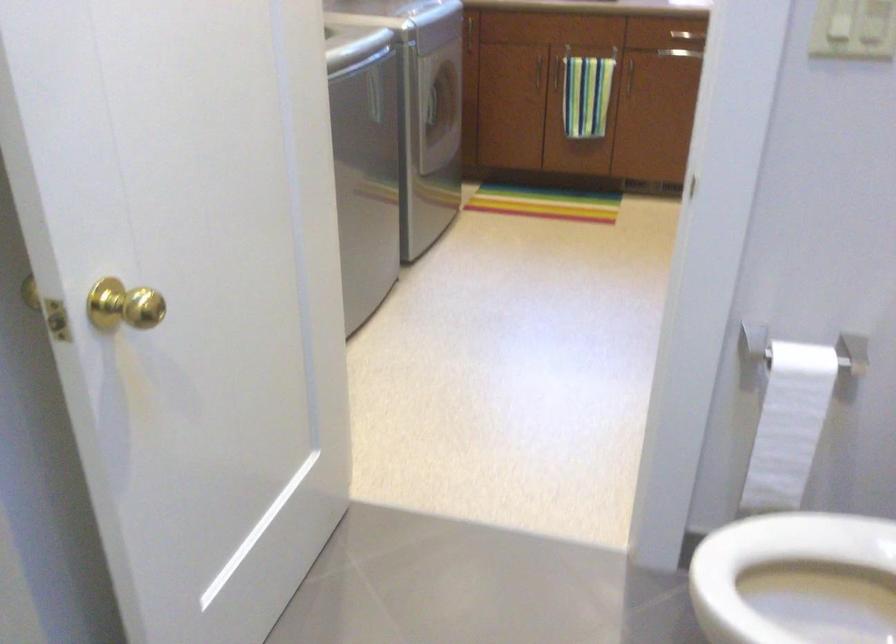
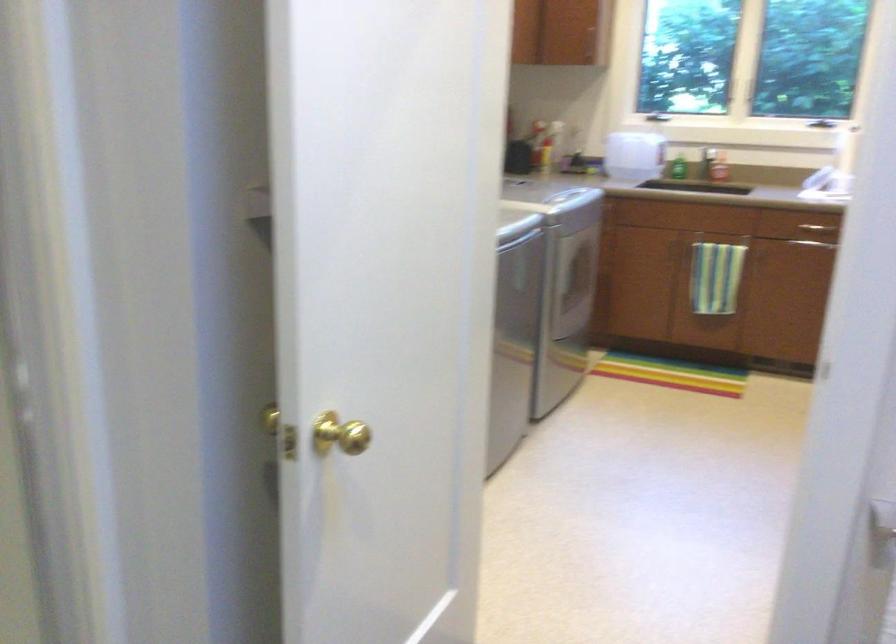
Locate, in the second image, the point that corresponds to pixel 135 301 in the first image.

(339, 433)